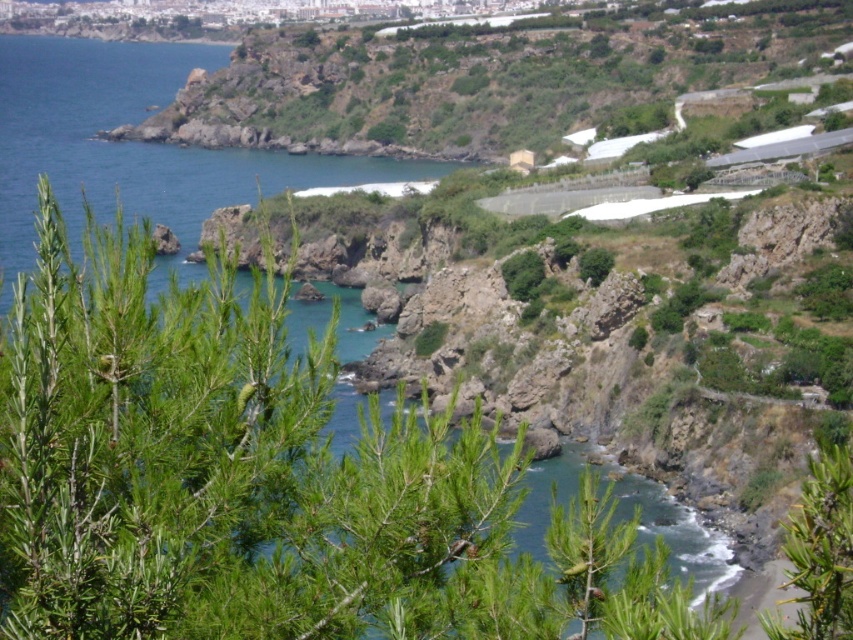
Question: Does green needle-like at center have a greater width compared to blue water at lower left?

Choices:
 (A) yes
 (B) no

Answer: (B)

Question: Observing the image, what is the correct spatial positioning of green needle-like at center in reference to green needle-like at lower right?

Choices:
 (A) left
 (B) right

Answer: (A)

Question: Estimate the real-world distances between objects in this image. Which object is farther from the blue water at lower left?

Choices:
 (A) green needle-like at lower right
 (B) green needle-like at center

Answer: (A)

Question: Which point is farther to the camera?

Choices:
 (A) green needle-like at center
 (B) blue water at lower left

Answer: (B)

Question: Can you confirm if blue water at lower left is positioned above green needle-like at lower right?

Choices:
 (A) yes
 (B) no

Answer: (A)

Question: Which of the following is the farthest from the observer?

Choices:
 (A) green needle-like at lower right
 (B) green needle-like at center

Answer: (A)